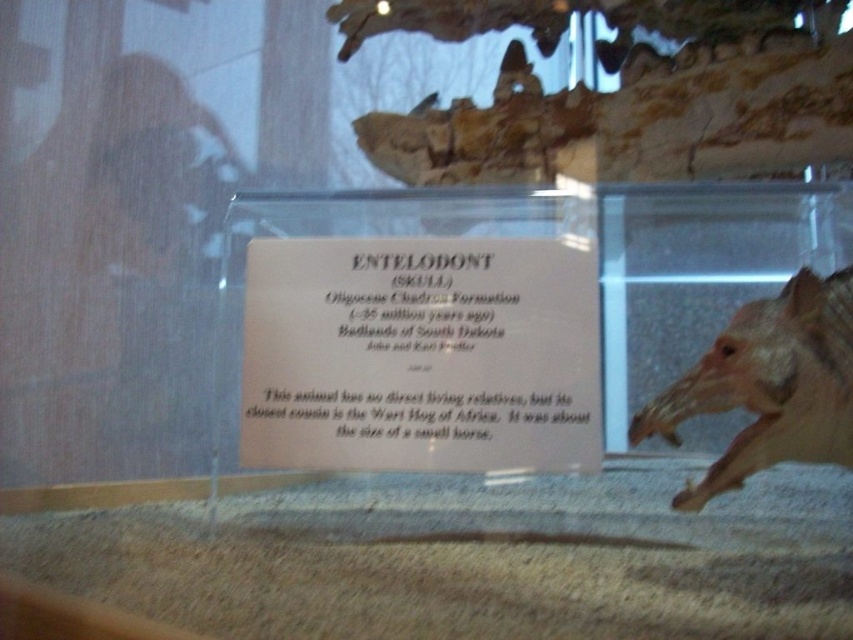
In the scene shown: Which is more to the right, white paper at center or light brown bone at right?

light brown bone at right

Does white paper at center appear over light brown bone at right?

Yes, white paper at center is above light brown bone at right.

Does point (263, 388) come closer to viewer compared to point (790, 458)?

No, it is behind (790, 458).

Locate an element on the screen. white paper at center is located at coordinates (421, 355).